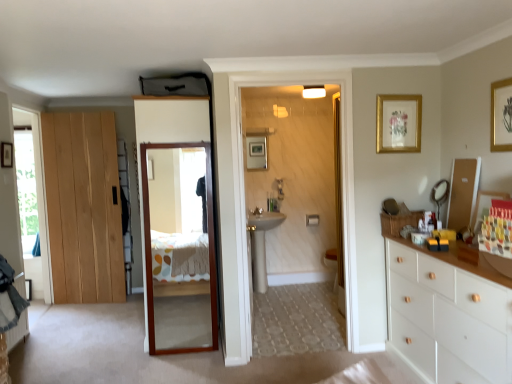
Question: Can wooden mirror at center, positioned as the 2th door in back-to-front order, be found inside gold-framed picture at upper right, marked as the 1th picture frame in a front-to-back arrangement?

Choices:
 (A) no
 (B) yes

Answer: (A)

Question: From a real-world perspective, is gold-framed picture at upper right, marked as the 1th picture frame in a front-to-back arrangement, on wooden mirror at center, positioned as the first door in front-to-back order?

Choices:
 (A) no
 (B) yes

Answer: (B)

Question: Is gold-framed picture at upper right, marked as the 1th picture frame in a front-to-back arrangement, to the left of wooden mirror at center, positioned as the first door in front-to-back order, from the viewer's perspective?

Choices:
 (A) no
 (B) yes

Answer: (A)

Question: Could you tell me if gold-framed picture at upper right, marked as the 1th picture frame in a front-to-back arrangement, is turned towards wooden mirror at center, the second door positioned from the left?

Choices:
 (A) yes
 (B) no

Answer: (B)

Question: Is gold-framed picture at upper right, positioned as the 3th picture frame in left-to-right order, facing away from wooden mirror at center, positioned as the first door in front-to-back order?

Choices:
 (A) yes
 (B) no

Answer: (B)

Question: Is transparent glass window at left, marked as the second window in a back-to-front arrangement, in front of or behind wooden-framed mirror at right, which ranks as the 1th mirror in front-to-back order, in the image?

Choices:
 (A) behind
 (B) front

Answer: (A)

Question: Choose the correct answer: Is transparent glass window at left, arranged as the 2th window when viewed from the left, inside wooden-framed mirror at right, acting as the second mirror starting from the back, or outside it?

Choices:
 (A) inside
 (B) outside

Answer: (B)

Question: From the image's perspective, relative to wooden-framed mirror at right, which ranks as the 1th mirror in front-to-back order, is transparent glass window at left, the first window from the right, above or below?

Choices:
 (A) below
 (B) above

Answer: (A)

Question: In the image, is transparent glass window at left, arranged as the 2th window when viewed from the left, on the left side or the right side of wooden-framed mirror at right, which ranks as the 1th mirror in front-to-back order?

Choices:
 (A) left
 (B) right

Answer: (A)

Question: Is matte black mirror at right, the 2th mirror in the front-to-back sequence, bigger or smaller than wooden mirror at center, positioned as the 2th door in back-to-front order?

Choices:
 (A) big
 (B) small

Answer: (B)

Question: Is point click(x=437, y=193) closer or farther from the camera than point click(x=190, y=132)?

Choices:
 (A) farther
 (B) closer

Answer: (B)

Question: Is matte black mirror at right, the 2th mirror in the front-to-back sequence, wider or thinner than wooden mirror at center, positioned as the first door in front-to-back order?

Choices:
 (A) wide
 (B) thin

Answer: (B)

Question: Which is correct: matte black mirror at right, the 2th mirror in the front-to-back sequence, is inside wooden mirror at center, the second door positioned from the left, or outside of it?

Choices:
 (A) outside
 (B) inside

Answer: (A)

Question: Looking at their shapes, would you say white ceramic sink at center is wider or thinner than gold-framed artwork at upper right, marked as the 2th picture frame in a left-to-right arrangement?

Choices:
 (A) wide
 (B) thin

Answer: (A)

Question: From the image's perspective, is white ceramic sink at center located above or below gold-framed artwork at upper right, which is counted as the 2th picture frame, starting from the back?

Choices:
 (A) above
 (B) below

Answer: (B)